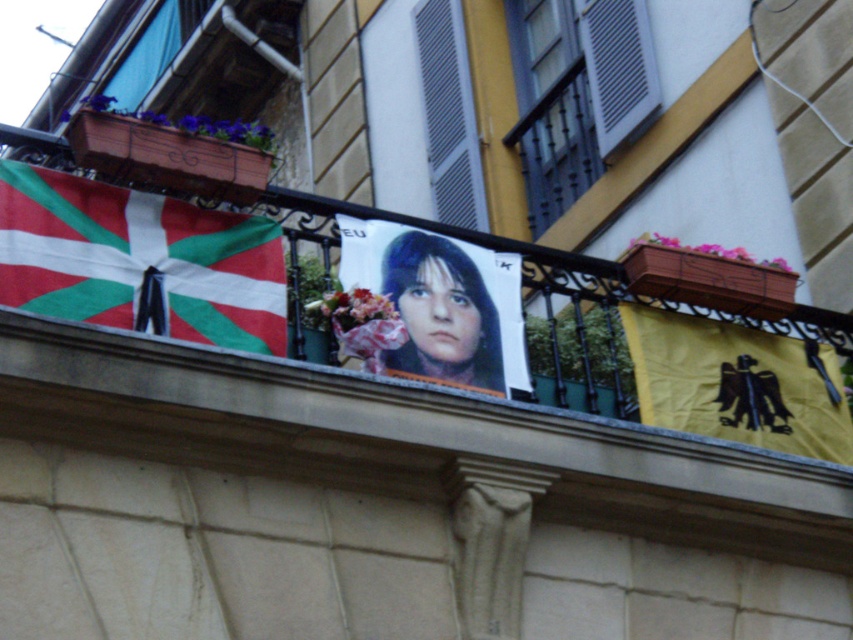
Question: In this image, where is yellow fabric eagle at right located relative to smooth paper portrait at center?

Choices:
 (A) right
 (B) left

Answer: (A)

Question: Which point is closer to the camera taking this photo?

Choices:
 (A) (225, 240)
 (B) (569, 481)

Answer: (A)

Question: Estimate the real-world distances between objects in this image. Which object is closer to the yellow fabric eagle at right?

Choices:
 (A) red and green fabric flag at left
 (B) matte paper poster at center

Answer: (B)

Question: Can you confirm if yellow fabric eagle at right is positioned above smooth paper portrait at center?

Choices:
 (A) yes
 (B) no

Answer: (B)

Question: Is yellow fabric eagle at right wider than smooth paper portrait at center?

Choices:
 (A) yes
 (B) no

Answer: (A)

Question: Which of these objects is positioned closest to the matte paper poster at center?

Choices:
 (A) smooth paper portrait at center
 (B) yellow fabric eagle at right
 (C) red and green fabric flag at left

Answer: (A)